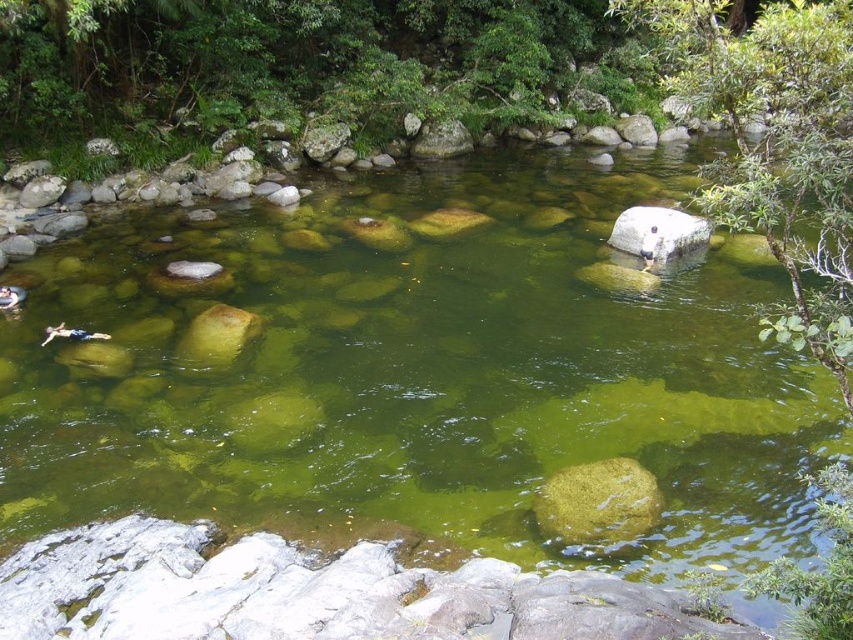
Question: Does green mossy rock at center lie in front of white smooth rock at center?

Choices:
 (A) yes
 (B) no

Answer: (A)

Question: Estimate the real-world distances between objects in this image. Which object is farther from the white smooth rock at center?

Choices:
 (A) green mossy rock at center
 (B) smooth gray rock at center
 (C) brown smooth rock at center

Answer: (B)

Question: Which object is positioned farthest from the brown smooth rock at center?

Choices:
 (A) smooth gray rock at center
 (B) green mossy rock at center

Answer: (A)

Question: Can you confirm if white smooth rock at center is positioned to the right of brown smooth rock at center?

Choices:
 (A) yes
 (B) no

Answer: (A)

Question: Considering the relative positions of green mossy rock at center and white smooth rock at center in the image provided, where is green mossy rock at center located with respect to white smooth rock at center?

Choices:
 (A) right
 (B) left

Answer: (B)

Question: Among these objects, which one is farthest from the camera?

Choices:
 (A) white smooth rock at center
 (B) smooth gray rock at center

Answer: (B)